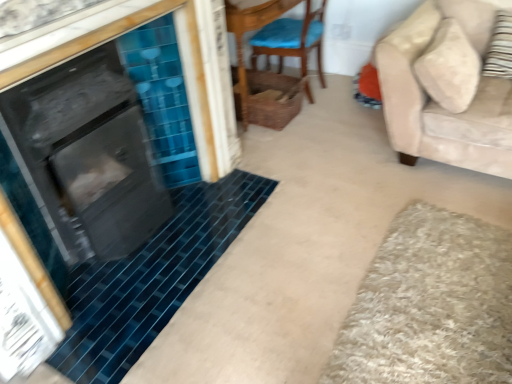
I want to click on beige fabric couch at right, so click(437, 103).

In order to face wooden chair with blue cushion at center, should I rotate leftwards or rightwards?

You should rotate right by 5.510 degrees.

Identify the location of woven brown basket at center. (268, 98).

The height and width of the screenshot is (384, 512). I want to click on woven wicker basket at upper center, so click(262, 72).

Based on the photo, from the image's perspective, between striped fabric pillow at right and wooden chair with blue cushion at center, which one is located above?

wooden chair with blue cushion at center, from the image's perspective.

Where is `chair above the striped fabric pillow at right (from the image's perspective)`? chair above the striped fabric pillow at right (from the image's perspective) is located at coordinates (291, 40).

Based on the photo, what's the angular difference between striped fabric pillow at right and wooden chair with blue cushion at center's facing directions?

striped fabric pillow at right and wooden chair with blue cushion at center are facing 85.4 degrees away from each other.

Based on their positions, is striped fabric pillow at right located to the left or right of wooden chair with blue cushion at center?

striped fabric pillow at right is positioned on wooden chair with blue cushion at center's right side.

From the image's perspective, is woven wicker basket at upper center above beige fabric couch at right?

Yes, from the image's perspective, woven wicker basket at upper center is over beige fabric couch at right.

Is point (295, 81) positioned before point (386, 59)?

That is False.

From a real-world perspective, who is located higher, woven wicker basket at upper center or beige fabric couch at right?

From a 3D spatial view, woven wicker basket at upper center is above.

Is woven wicker basket at upper center at the left side of beige fabric couch at right?

Yes.

Locate an element on the screen. The height and width of the screenshot is (384, 512). pillow lying on the right of woven brown basket at center is located at coordinates (500, 48).

Which is more to the right, woven brown basket at center or striped fabric pillow at right?

Positioned to the right is striped fabric pillow at right.

Based on their sizes in the image, would you say woven brown basket at center is bigger or smaller than striped fabric pillow at right?

Clearly, woven brown basket at center is larger in size than striped fabric pillow at right.

Are woven brown basket at center and wooden chair with blue cushion at center located far from each other?

No, woven brown basket at center is in close proximity to wooden chair with blue cushion at center.

Which object is more forward, woven brown basket at center or wooden chair with blue cushion at center?

wooden chair with blue cushion at center is closer to the camera.

Between woven brown basket at center and wooden chair with blue cushion at center, which one has more height?

wooden chair with blue cushion at center.

Between woven brown basket at center and wooden chair with blue cushion at center, which one has smaller size?

woven brown basket at center is smaller.

Looking at this image, considering the relative sizes of striped fabric pillow at right and woven wicker basket at upper center in the image provided, is striped fabric pillow at right taller than woven wicker basket at upper center?

No.

Is striped fabric pillow at right oriented away from woven wicker basket at upper center?

No.

Does point (500, 35) come in front of point (267, 105)?

Yes, point (500, 35) is closer to viewer.

Is striped fabric pillow at right wider or thinner than woven wicker basket at upper center?

Clearly, striped fabric pillow at right has less width compared to woven wicker basket at upper center.

Measure the distance from beige fabric couch at right to wooden chair with blue cushion at center.

A distance of 38.46 inches exists between beige fabric couch at right and wooden chair with blue cushion at center.

Considering the positions of point (388, 89) and point (318, 27), is point (388, 89) closer or farther from the camera than point (318, 27)?

Point (388, 89) appears to be closer to the viewer than point (318, 27).

Does beige fabric couch at right come behind wooden chair with blue cushion at center?

No.

Consider the image. Does beige fabric couch at right have a greater height compared to wooden chair with blue cushion at center?

Yes, beige fabric couch at right is taller than wooden chair with blue cushion at center.

Identify the location of chair on the left of beige fabric couch at right. (291, 40).

Between point (304, 53) and point (413, 157), which one is positioned in front?

The point (413, 157) is closer to the camera.

Which of these two, wooden chair with blue cushion at center or beige fabric couch at right, is thinner?

wooden chair with blue cushion at center is thinner.

Image resolution: width=512 pixels, height=384 pixels. In order to click on pillow above the wooden chair with blue cushion at center (from a real-world perspective) in this screenshot , I will do `click(500, 48)`.

Where is `studio couch that appears below the woven wicker basket at upper center (from a real-world perspective)`? This screenshot has width=512, height=384. studio couch that appears below the woven wicker basket at upper center (from a real-world perspective) is located at coordinates (437, 103).

Considering their positions, is wooden chair with blue cushion at center positioned further to woven brown basket at center than beige shaggy bath mat at lower right?

beige shaggy bath mat at lower right is positioned further to the anchor woven brown basket at center.

Which object lies nearer to the anchor point beige shaggy bath mat at lower right, woven wicker basket at upper center or striped fabric pillow at right?

The object closer to beige shaggy bath mat at lower right is striped fabric pillow at right.

Considering their positions, is beige fabric couch at right positioned further to woven brown basket at center than striped fabric pillow at right?

striped fabric pillow at right is further to woven brown basket at center.

Which object lies nearer to the anchor point striped fabric pillow at right, beige fabric couch at right or woven wicker basket at upper center?

beige fabric couch at right is positioned closer to the anchor striped fabric pillow at right.

Looking at this image, from the image, which object appears to be nearer to beige shaggy bath mat at lower right, beige fabric couch at right or wooden chair with blue cushion at center?

Among the two, beige fabric couch at right is located nearer to beige shaggy bath mat at lower right.

When comparing their distances from beige shaggy bath mat at lower right, does woven brown basket at center or woven wicker basket at upper center seem further?

Based on the image, woven wicker basket at upper center appears to be further to beige shaggy bath mat at lower right.

Looking at the image, which one is located closer to woven brown basket at center, striped fabric pillow at right or woven wicker basket at upper center?

woven wicker basket at upper center.

Estimate the real-world distances between objects in this image. Which object is closer to woven brown basket at center, beige fabric couch at right or beige shaggy bath mat at lower right?

beige fabric couch at right lies closer to woven brown basket at center than the other object.

Where is `chair between woven brown basket at center and striped fabric pillow at right from left to right`? This screenshot has height=384, width=512. chair between woven brown basket at center and striped fabric pillow at right from left to right is located at coordinates (291, 40).

This screenshot has height=384, width=512. In order to click on studio couch between striped fabric pillow at right and beige shaggy bath mat at lower right from top to bottom in this screenshot , I will do `click(437, 103)`.

At what (x,y) coordinates should I click in order to perform the action: click on pillow located between beige shaggy bath mat at lower right and woven brown basket at center in the depth direction. Please return your answer as a coordinate pair (x, y). Looking at the image, I should click on (500, 48).

The height and width of the screenshot is (384, 512). Find the location of `side table between wooden chair with blue cushion at center and woven brown basket at center in the up-down direction`. side table between wooden chair with blue cushion at center and woven brown basket at center in the up-down direction is located at coordinates (262, 72).